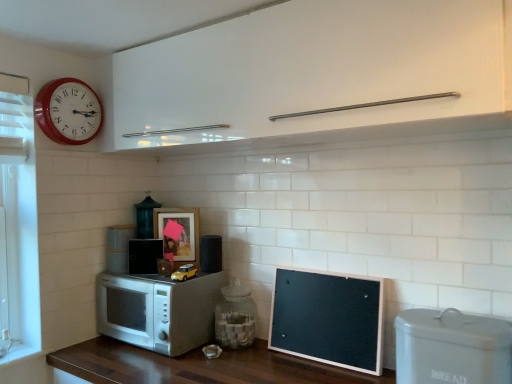
Question: Would you say matte wooden picture frame at center is outside black matte speaker at center, the third appliance in the back-to-front sequence?

Choices:
 (A) no
 (B) yes

Answer: (B)

Question: Is matte wooden picture frame at center looking in the opposite direction of black matte speaker at center, which is the third appliance in right-to-left order?

Choices:
 (A) yes
 (B) no

Answer: (B)

Question: Does matte wooden picture frame at center have a smaller size compared to black matte speaker at center, the 4th appliance from the front?

Choices:
 (A) yes
 (B) no

Answer: (B)

Question: Is matte wooden picture frame at center not close to black matte speaker at center, the third appliance in the back-to-front sequence?

Choices:
 (A) no
 (B) yes

Answer: (A)

Question: Is matte wooden picture frame at center bigger than black matte speaker at center, the fourth appliance positioned from the left?

Choices:
 (A) no
 (B) yes

Answer: (B)

Question: Considering the relative positions of white plastic bread bin at lower right, which is counted as the 1th appliance, starting from the right, and transparent glass jar at center, the 4th appliance from the back, in the image provided, is white plastic bread bin at lower right, which is counted as the 1th appliance, starting from the right, to the left or to the right of transparent glass jar at center, the 4th appliance from the back,?

Choices:
 (A) right
 (B) left

Answer: (A)

Question: Is white plastic bread bin at lower right, acting as the 6th appliance starting from the back, inside the boundaries of transparent glass jar at center, which appears as the 3th appliance when viewed from the front, or outside?

Choices:
 (A) inside
 (B) outside

Answer: (B)

Question: Relative to transparent glass jar at center, the 4th appliance from the back, is white plastic bread bin at lower right, acting as the 6th appliance starting from the back, in front or behind?

Choices:
 (A) behind
 (B) front

Answer: (B)

Question: Based on their sizes in the image, would you say white plastic bread bin at lower right, acting as the 6th appliance starting from the back, is bigger or smaller than transparent glass jar at center, which appears as the 3th appliance when viewed from the front?

Choices:
 (A) small
 (B) big

Answer: (A)

Question: In the image, is black matte speaker at center, the third appliance in the back-to-front sequence, on the left side or the right side of metallic green lantern at center, which is counted as the fifth appliance, starting from the right?

Choices:
 (A) left
 (B) right

Answer: (B)

Question: Looking at their shapes, would you say black matte speaker at center, the 4th appliance from the front, is wider or thinner than metallic green lantern at center, the 6th appliance viewed from the front?

Choices:
 (A) thin
 (B) wide

Answer: (A)

Question: From a real-world perspective, is black matte speaker at center, the fourth appliance positioned from the left, physically located above or below metallic green lantern at center, the 6th appliance viewed from the front?

Choices:
 (A) above
 (B) below

Answer: (B)

Question: Considering their positions, is black matte speaker at center, which is the third appliance in right-to-left order, located in front of or behind metallic green lantern at center, which appears as the 1th appliance when viewed from the back?

Choices:
 (A) behind
 (B) front

Answer: (B)

Question: Considering the positions of point (211, 263) and point (111, 269), is point (211, 263) closer or farther from the camera than point (111, 269)?

Choices:
 (A) closer
 (B) farther

Answer: (B)

Question: From a real-world perspective, relative to white matte microwave at lower left, the 2th appliance from the back, is black matte speaker at center, which is the third appliance in right-to-left order, vertically above or below?

Choices:
 (A) above
 (B) below

Answer: (B)